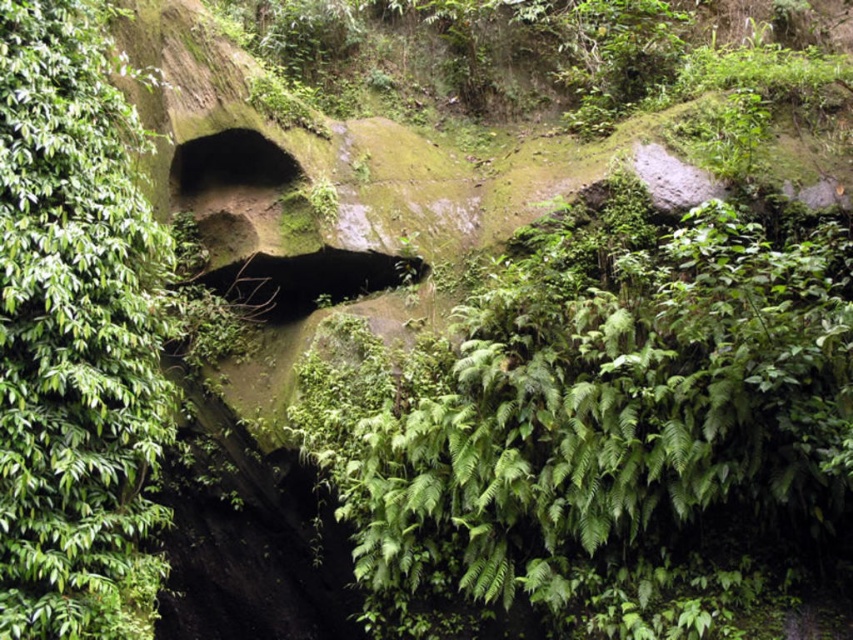
Based on the photo, between green leafy ferns at center and green leafy tree at left, which one has less height?

green leafy ferns at center

Measure the distance from green leafy ferns at center to green leafy tree at left.

The distance of green leafy ferns at center from green leafy tree at left is 3.46 meters.

I want to click on green leafy ferns at center, so click(602, 417).

Where is `green leafy ferns at center`? Image resolution: width=853 pixels, height=640 pixels. green leafy ferns at center is located at coordinates (602, 417).